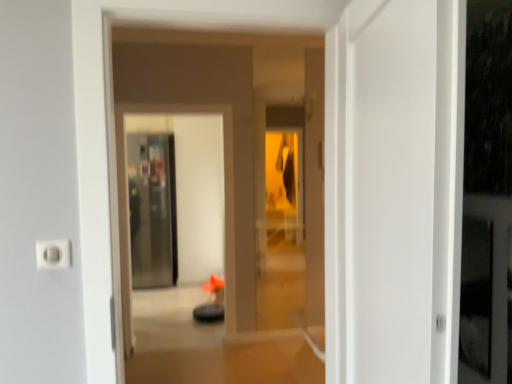
Question: Would you say transparent glass screen door at center, which is the first screen door from front to back, is inside or outside transparent glass screen door at center, which is the 2th screen door from right to left?

Choices:
 (A) inside
 (B) outside

Answer: (B)

Question: From the image's perspective, is transparent glass screen door at center, the 1th screen door when ordered from right to left, positioned above or below transparent glass screen door at center, which is the 2th screen door from right to left?

Choices:
 (A) below
 (B) above

Answer: (A)

Question: Which is farther from the orange fabric chair at center?

Choices:
 (A) transparent glass screen door at center, which is the 2th screen door from right to left
 (B) white plastic electric outlet at lower left
 (C) transparent glass screen door at center, which is the first screen door from front to back

Answer: (B)

Question: Estimate the real-world distances between objects in this image. Which object is closer to the white plastic electric outlet at lower left?

Choices:
 (A) transparent glass screen door at center, marked as the second screen door in a back-to-front arrangement
 (B) transparent glass screen door at center, which is the 2th screen door from right to left
 (C) orange fabric chair at center

Answer: (A)